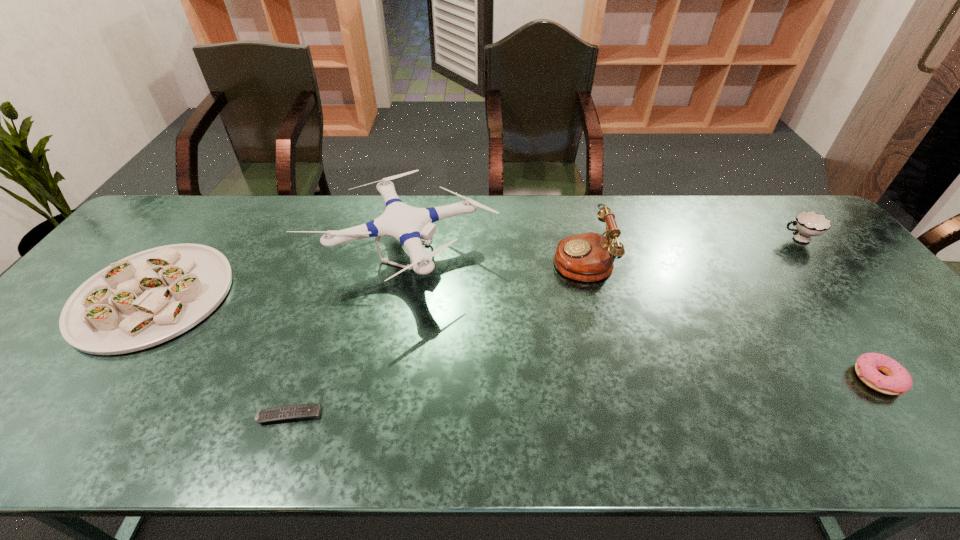
I want to click on the third object from right to left, so click(588, 257).

Where is `drone`? The width and height of the screenshot is (960, 540). drone is located at coordinates pos(407,224).

I want to click on cup, so click(x=808, y=224).

This screenshot has width=960, height=540. Identify the location of the fourth tallest object. (148, 298).

The width and height of the screenshot is (960, 540). What are the coordinates of `the leftmost object` in the screenshot? It's located at (148, 298).

Where is `the fifth tallest object`? The image size is (960, 540). the fifth tallest object is located at coordinates (897, 381).

Find the location of a particular element. Image resolution: width=960 pixels, height=540 pixels. the second nearest object is located at coordinates (897, 381).

The height and width of the screenshot is (540, 960). Identify the location of the nearest object. pyautogui.click(x=302, y=411).

The height and width of the screenshot is (540, 960). In order to click on the shortest object in this screenshot , I will do `click(302, 411)`.

You are a GUI agent. You are given a task and a screenshot of the screen. Output one action in this format:
    pyautogui.click(x=<x>, y=<y>)
    Task: Click on the free space located on the dial of the telephone
    This screenshot has width=960, height=540.
    Given the screenshot: What is the action you would take?
    pyautogui.click(x=509, y=258)